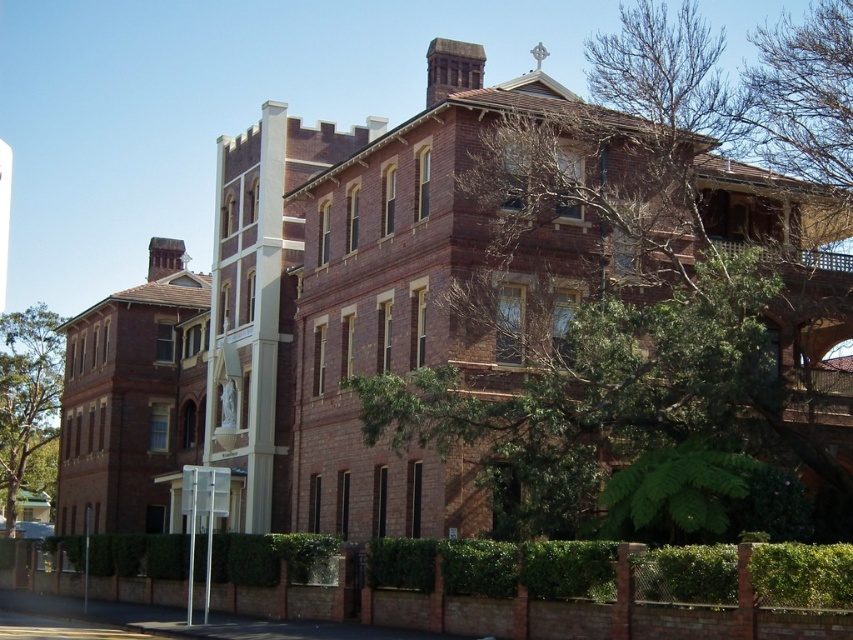
Consider the image. You are standing in front of the building and notice a green leafy tree at upper right and a white glossy pole at center. Which object is positioned higher relative to the other?

The green leafy tree at upper right is positioned higher than the white glossy pole at center.